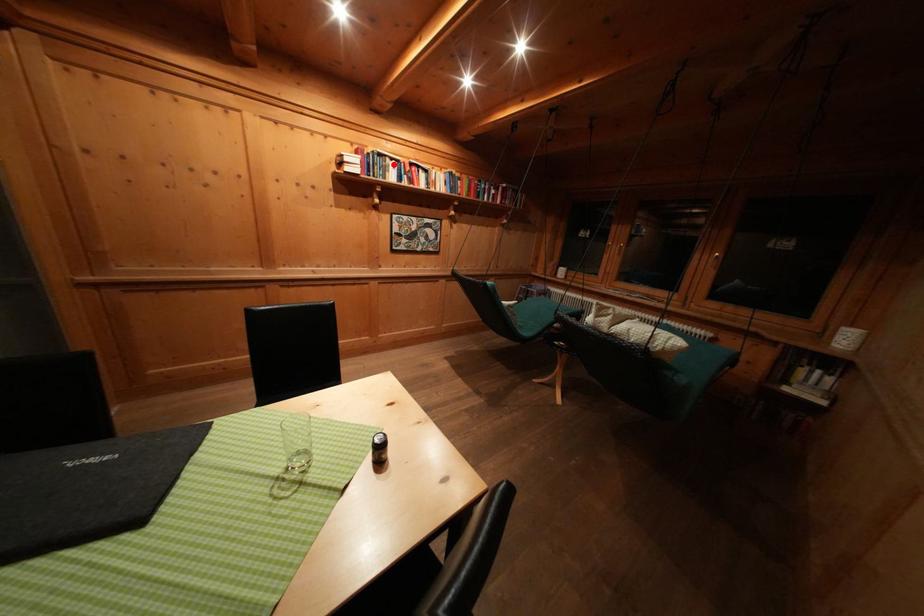
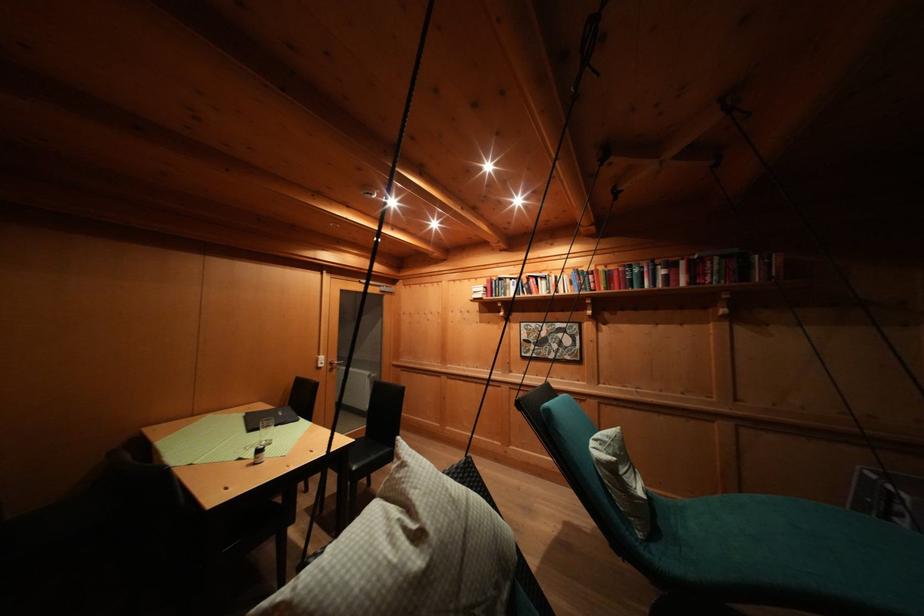
Locate, in the second image, the point that corresponds to the highlighted location in the first image.

(514, 285)